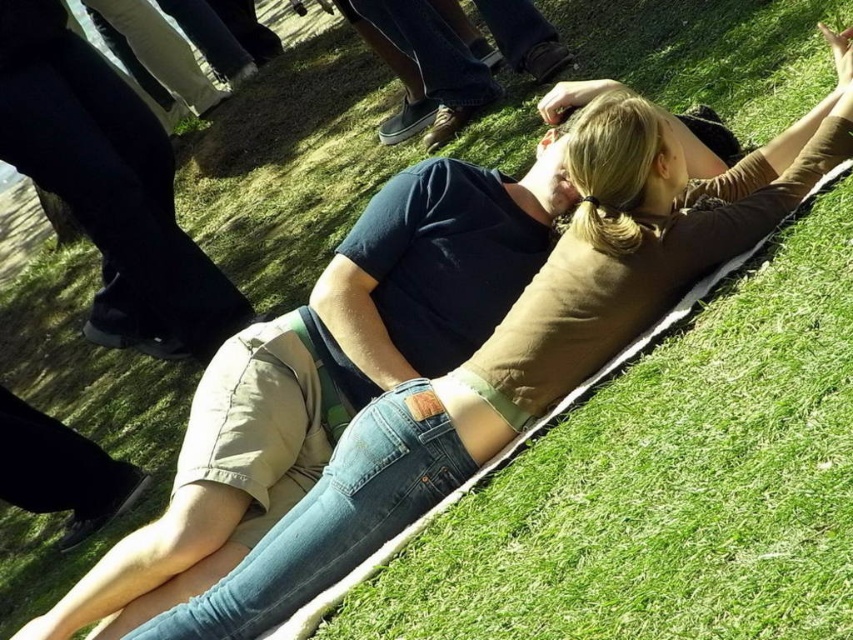
Can you confirm if black matte pants at lower left is positioned to the left of denim shorts at center?

Yes, black matte pants at lower left is to the left of denim shorts at center.

Can you confirm if black matte pants at lower left is positioned below denim shorts at center?

Indeed, black matte pants at lower left is positioned under denim shorts at center.

What do you see at coordinates (109, 186) in the screenshot? The height and width of the screenshot is (640, 853). I see `black matte pants at lower left` at bounding box center [109, 186].

At what (x,y) coordinates should I click in order to perform the action: click on black matte pants at lower left. Please return your answer as a coordinate pair (x, y). Image resolution: width=853 pixels, height=640 pixels. Looking at the image, I should click on (109, 186).